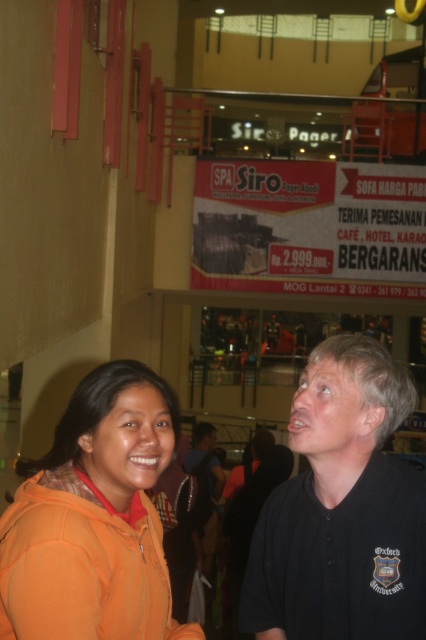
You are standing in the shopping mall and see the orange fleece at center and the black shirt at center. Which one is positioned to the right?

The orange fleece at center is positioned to the right of the black shirt at center.

You are a security guard in the mall and need to check the distance between the orange fleece at center and the black shirt at center. Which one is closer to you?

The orange fleece at center is closer to you since it is further to the viewer than the black shirt at center.

In the scene shown: You are a delivery robot with a 25 inch wide package. You need to navigate between the black shirt at center and orange fleece at lower left to deliver the package. Can you fit through the space between them?

The black shirt at center and orange fleece at lower left are 27.11 inches apart from each other. Since the package is 25 inches wide, the robot can fit through the space between them as there is enough clearance.